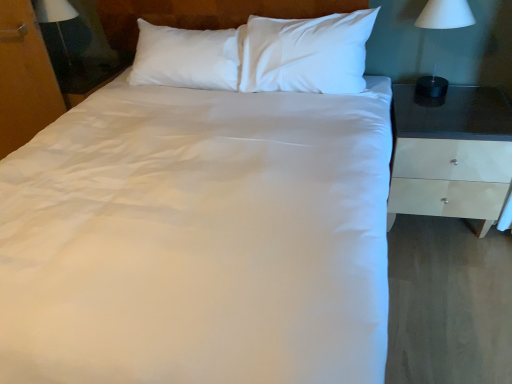
Question: Is matte black lampshade at left, placed as the second bedside lamp when sorted from right to left, surrounded by white matte lamp at right, which appears as the second bedside lamp when viewed from the left?

Choices:
 (A) no
 (B) yes

Answer: (A)

Question: From the image's perspective, is white matte lamp at right, which appears as the second bedside lamp when viewed from the left, above matte black lampshade at left, placed as the second bedside lamp when sorted from right to left?

Choices:
 (A) no
 (B) yes

Answer: (A)

Question: From the image's perspective, is white matte lamp at right, the 2th bedside lamp from the back, beneath matte black lampshade at left, which ranks as the 1th bedside lamp in left-to-right order?

Choices:
 (A) no
 (B) yes

Answer: (B)

Question: Would you say white matte lamp at right, marked as the 1th bedside lamp in a front-to-back arrangement, is outside matte black lampshade at left, the second bedside lamp from the front?

Choices:
 (A) no
 (B) yes

Answer: (B)

Question: Does white matte lamp at right, marked as the 1th bedside lamp in a front-to-back arrangement, have a smaller size compared to matte black lampshade at left, placed as the second bedside lamp when sorted from right to left?

Choices:
 (A) no
 (B) yes

Answer: (B)

Question: Considering the positions of white glossy nightstand at right and wooden dresser at left in the image, is white glossy nightstand at right bigger or smaller than wooden dresser at left?

Choices:
 (A) small
 (B) big

Answer: (B)

Question: From the image's perspective, is white glossy nightstand at right located above or below wooden dresser at left?

Choices:
 (A) below
 (B) above

Answer: (A)

Question: From a real-world perspective, is white glossy nightstand at right positioned above or below wooden dresser at left?

Choices:
 (A) above
 (B) below

Answer: (B)

Question: Is white glossy nightstand at right taller or shorter than wooden dresser at left?

Choices:
 (A) short
 (B) tall

Answer: (A)

Question: Is wooden dresser at left inside or outside of matte black lampshade at left, the first bedside lamp in the back-to-front sequence?

Choices:
 (A) outside
 (B) inside

Answer: (A)

Question: Considering the positions of point (28, 14) and point (38, 0), is point (28, 14) closer or farther from the camera than point (38, 0)?

Choices:
 (A) farther
 (B) closer

Answer: (B)

Question: From a real-world perspective, is wooden dresser at left positioned above or below matte black lampshade at left, placed as the second bedside lamp when sorted from right to left?

Choices:
 (A) below
 (B) above

Answer: (A)

Question: In the image, is wooden dresser at left positioned in front of or behind matte black lampshade at left, the second bedside lamp from the front?

Choices:
 (A) front
 (B) behind

Answer: (A)

Question: From a real-world perspective, is white matte lamp at right, marked as the 1th bedside lamp in a front-to-back arrangement, physically located above or below wooden dresser at left?

Choices:
 (A) above
 (B) below

Answer: (A)

Question: In terms of height, does white matte lamp at right, marked as the 1th bedside lamp in a front-to-back arrangement, look taller or shorter compared to wooden dresser at left?

Choices:
 (A) tall
 (B) short

Answer: (B)